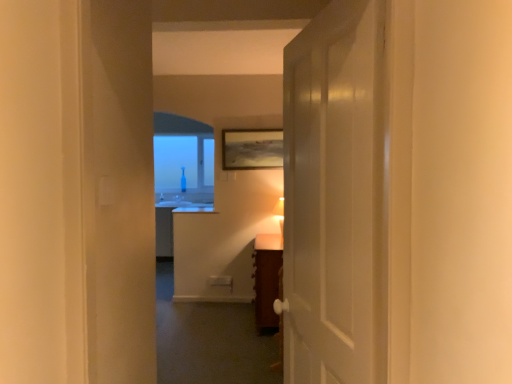
Question: Could you tell me if matte white table lamp at center is turned towards matte wooden picture frame at upper center?

Choices:
 (A) no
 (B) yes

Answer: (A)

Question: From a real-world perspective, is matte white table lamp at center positioned under matte wooden picture frame at upper center based on gravity?

Choices:
 (A) yes
 (B) no

Answer: (A)

Question: Is the surface of matte white table lamp at center in direct contact with matte wooden picture frame at upper center?

Choices:
 (A) no
 (B) yes

Answer: (A)

Question: Is matte white table lamp at center not within matte wooden picture frame at upper center?

Choices:
 (A) no
 (B) yes

Answer: (B)

Question: Is matte white table lamp at center thinner than matte wooden picture frame at upper center?

Choices:
 (A) no
 (B) yes

Answer: (A)

Question: From a real-world perspective, relative to brown wooden vanity at center, is transparent glass bottle at center vertically above or below?

Choices:
 (A) above
 (B) below

Answer: (A)

Question: Considering the relative positions of transparent glass bottle at center and brown wooden vanity at center in the image provided, is transparent glass bottle at center to the left or to the right of brown wooden vanity at center?

Choices:
 (A) right
 (B) left

Answer: (B)

Question: Considering their positions, is transparent glass bottle at center located in front of or behind brown wooden vanity at center?

Choices:
 (A) behind
 (B) front

Answer: (A)

Question: From their relative heights in the image, would you say transparent glass bottle at center is taller or shorter than brown wooden vanity at center?

Choices:
 (A) short
 (B) tall

Answer: (B)

Question: Based on their sizes in the image, would you say brown wooden vanity at center is bigger or smaller than matte white table lamp at center?

Choices:
 (A) big
 (B) small

Answer: (A)

Question: Considering the positions of point (261, 299) and point (283, 215), is point (261, 299) closer or farther from the camera than point (283, 215)?

Choices:
 (A) closer
 (B) farther

Answer: (B)

Question: Considering the positions of brown wooden vanity at center and matte white table lamp at center in the image, is brown wooden vanity at center taller or shorter than matte white table lamp at center?

Choices:
 (A) tall
 (B) short

Answer: (A)

Question: Based on their positions, is brown wooden vanity at center located to the left or right of matte white table lamp at center?

Choices:
 (A) left
 (B) right

Answer: (A)

Question: From a real-world perspective, is brown wooden vanity at center positioned above or below white glossy door at center?

Choices:
 (A) above
 (B) below

Answer: (B)

Question: Is point (x=282, y=258) positioned closer to the camera than point (x=345, y=349)?

Choices:
 (A) farther
 (B) closer

Answer: (A)